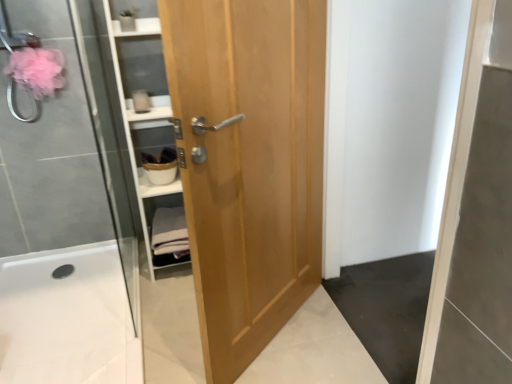
Question: Could you tell me if light brown wood door at center is turned towards white cotton towels at center?

Choices:
 (A) yes
 (B) no

Answer: (B)

Question: Would you say light brown wood door at center is a long distance from white cotton towels at center?

Choices:
 (A) no
 (B) yes

Answer: (A)

Question: Does light brown wood door at center have a greater width compared to white cotton towels at center?

Choices:
 (A) no
 (B) yes

Answer: (A)

Question: Does light brown wood door at center lie behind white cotton towels at center?

Choices:
 (A) yes
 (B) no

Answer: (B)

Question: Is light brown wood door at center positioned in front of white cotton towels at center?

Choices:
 (A) no
 (B) yes

Answer: (B)

Question: Does light brown wood door at center have a greater height compared to white cotton towels at center?

Choices:
 (A) yes
 (B) no

Answer: (A)

Question: Can you see light brown wood door at center touching white glossy bath at lower left?

Choices:
 (A) yes
 (B) no

Answer: (B)

Question: Is light brown wood door at center facing towards white glossy bath at lower left?

Choices:
 (A) yes
 (B) no

Answer: (B)

Question: Is light brown wood door at center behind white glossy bath at lower left?

Choices:
 (A) no
 (B) yes

Answer: (A)

Question: Can you confirm if light brown wood door at center is shorter than white glossy bath at lower left?

Choices:
 (A) yes
 (B) no

Answer: (B)

Question: From a real-world perspective, does light brown wood door at center sit lower than white glossy bath at lower left?

Choices:
 (A) no
 (B) yes

Answer: (A)

Question: From the image's perspective, would you say light brown wood door at center is shown under white glossy bath at lower left?

Choices:
 (A) no
 (B) yes

Answer: (A)

Question: Can you confirm if white cotton towels at center is wider than light brown wood door at center?

Choices:
 (A) no
 (B) yes

Answer: (B)